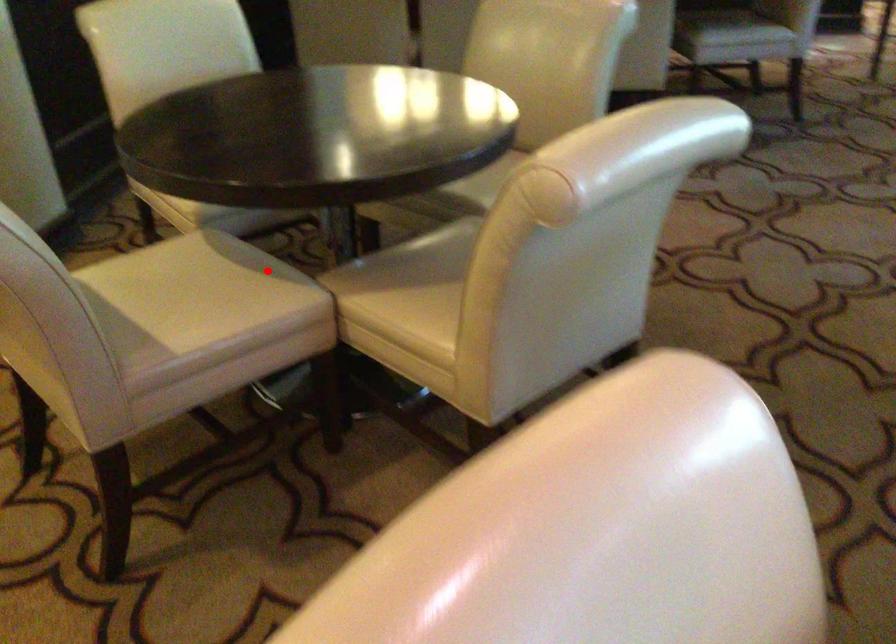
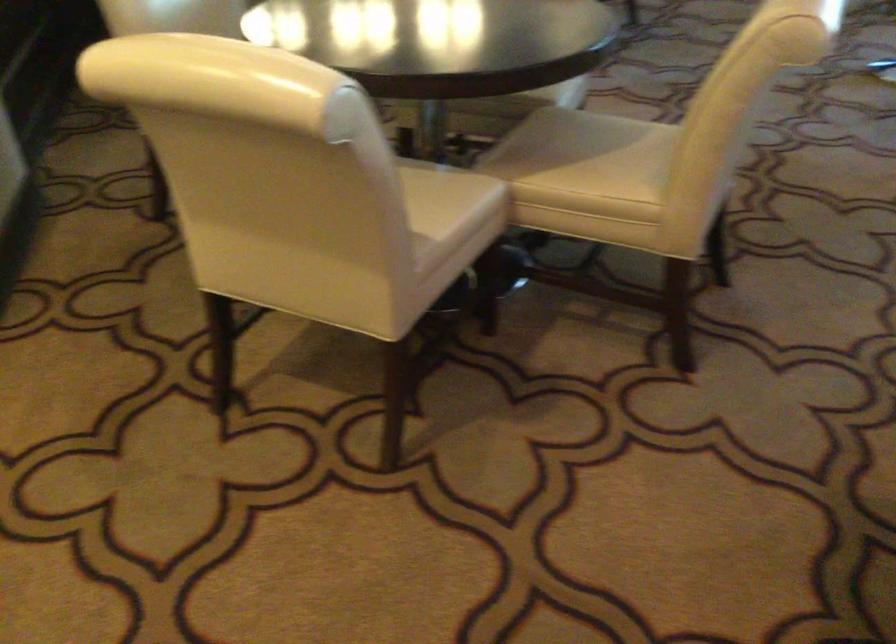
Locate, in the second image, the point that corresponds to the highlighted location in the first image.

(437, 167)